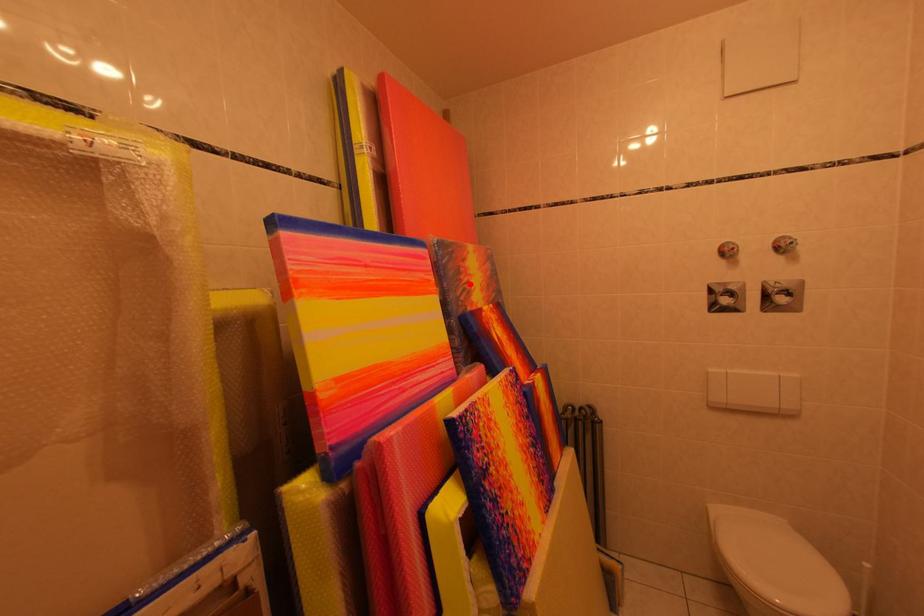
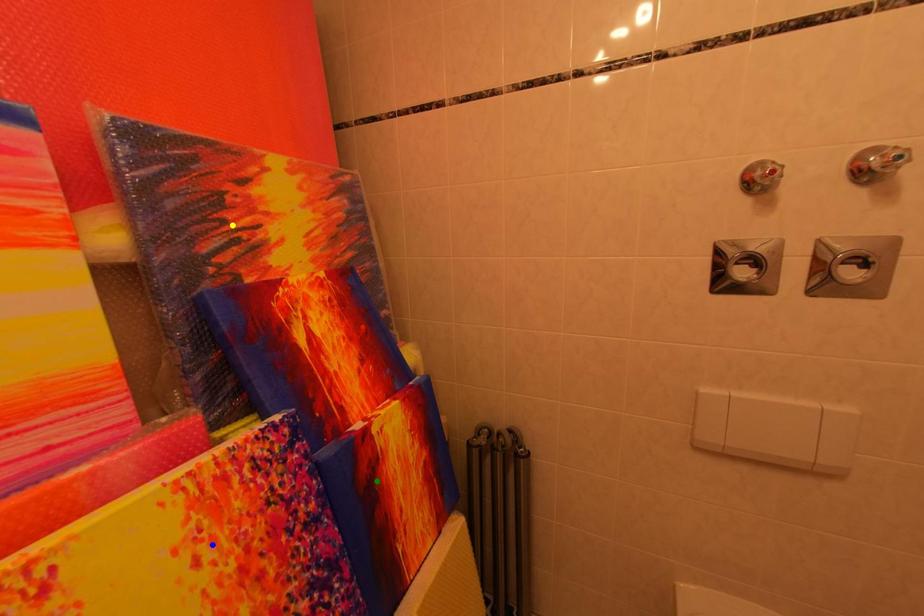
Question: I am providing you with two images of the same scene from different viewpoints. A red point is marked on the first image. You are given multiple points on the second image. Which mark in image 2 goes with the point in image 1?

Choices:
 (A) blue point
 (B) yellow point
 (C) green point

Answer: (B)